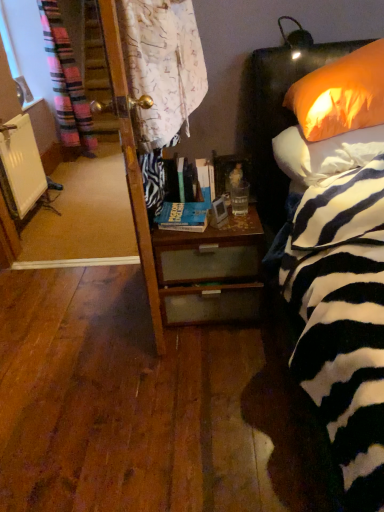
Locate an element on the screen. hardcover book at center, the second book positioned from the back is located at coordinates (183, 217).

Measure the distance between translucent glass at bedside and camera.

A distance of 5.94 feet exists between translucent glass at bedside and camera.

What do you see at coordinates (211, 272) in the screenshot?
I see `woodendesk at center` at bounding box center [211, 272].

Consider the image. In order to face orange fabric pillow at upper right, the first pillow ordered from the bottom, should I rotate leftwards or rightwards?

To face it directly, rotate right by 20.249 degrees.

You are a GUI agent. You are given a task and a screenshot of the screen. Output one action in this format:
    pyautogui.click(x=<x>, y=<y>)
    Task: Click on the hardcover book at center, the first book when ordered from bottom to top
    This screenshot has width=384, height=512.
    Given the screenshot: What is the action you would take?
    pyautogui.click(x=183, y=217)

From the image's perspective, is woodendesk at center above or below orange fabric pillow at upper right, arranged as the 2th pillow when ordered from the bottom?

Based on their image positions, woodendesk at center is located beneath orange fabric pillow at upper right, arranged as the 2th pillow when ordered from the bottom.

In the scene shown: What's the angular difference between woodendesk at center and orange fabric pillow at upper right, which is the 1th pillow from top to bottom,'s facing directions?

0.468 degrees separate the facing orientations of woodendesk at center and orange fabric pillow at upper right, which is the 1th pillow from top to bottom.

Is woodendesk at center facing away from orange fabric pillow at upper right, which is the 1th pillow from top to bottom?

No, woodendesk at center's orientation is not away from orange fabric pillow at upper right, which is the 1th pillow from top to bottom.

Is point (220, 230) positioned before point (335, 131)?

No, (220, 230) is further to viewer.

Considering the relative sizes of hardcover book at center, the 1th book from the front, and woodendesk at center in the image provided, is hardcover book at center, the 1th book from the front, shorter than woodendesk at center?

Yes, hardcover book at center, the 1th book from the front, is shorter than woodendesk at center.

Are hardcover book at center, the 1th book from the front, and woodendesk at center far apart?

hardcover book at center, the 1th book from the front, is near woodendesk at center, not far away.

Is hardcover book at center, the first book when ordered from bottom to top, oriented away from woodendesk at center?

No, hardcover book at center, the first book when ordered from bottom to top, is not facing the opposite direction of woodendesk at center.

Which object is positioned more to the left, hardcover book at center, which is counted as the 2th book, starting from the top, or woodendesk at center?

hardcover book at center, which is counted as the 2th book, starting from the top.

Is orange fabric pillow at upper right, marked as the second pillow in a top-to-bottom arrangement, looking in the opposite direction of white matte radiator at left?

orange fabric pillow at upper right, marked as the second pillow in a top-to-bottom arrangement, is not turned away from white matte radiator at left.

Can you confirm if orange fabric pillow at upper right, marked as the second pillow in a top-to-bottom arrangement, is shorter than white matte radiator at left?

Correct, orange fabric pillow at upper right, marked as the second pillow in a top-to-bottom arrangement, is not as tall as white matte radiator at left.

Consider the image. In terms of width, does orange fabric pillow at upper right, the first pillow ordered from the bottom, look wider or thinner when compared to white matte radiator at left?

Considering their sizes, orange fabric pillow at upper right, the first pillow ordered from the bottom, looks broader than white matte radiator at left.

Is orange fabric pillow at upper right, marked as the second pillow in a top-to-bottom arrangement, completely or partially outside of white matte radiator at left?

orange fabric pillow at upper right, marked as the second pillow in a top-to-bottom arrangement, lies outside white matte radiator at left's area.

From the image's perspective, between translucent glass at bedside and woodendesk at center, which one is located above?

translucent glass at bedside appears higher in the image.

Is translucent glass at bedside next to woodendesk at center?

No, translucent glass at bedside is not beside woodendesk at center.

Is translucent glass at bedside positioned with its back to woodendesk at center?

Correct, translucent glass at bedside is looking away from woodendesk at center.

Is hardcover book at center, which is the second book in bottom-to-top order, outside of white matte radiator at left?

hardcover book at center, which is the second book in bottom-to-top order, is positioned outside white matte radiator at left.

Which is farther from the camera, (x=210, y=186) or (x=22, y=172)?

The point (x=22, y=172) is farther from the camera.

From a real-world perspective, is hardcover book at center, which is the second book in bottom-to-top order, physically located above or below white matte radiator at left?

Clearly, from a real-world perspective, hardcover book at center, which is the second book in bottom-to-top order, is above white matte radiator at left.

From a real-world perspective, is translucent glass at bedside physically above orange fabric pillow at upper right, marked as the second pillow in a top-to-bottom arrangement?

Actually, translucent glass at bedside is physically below orange fabric pillow at upper right, marked as the second pillow in a top-to-bottom arrangement, in the real world.

In the image, is translucent glass at bedside positioned in front of or behind orange fabric pillow at upper right, marked as the second pillow in a top-to-bottom arrangement?

In the image, translucent glass at bedside appears behind orange fabric pillow at upper right, marked as the second pillow in a top-to-bottom arrangement.

Is translucent glass at bedside directly adjacent to orange fabric pillow at upper right, marked as the second pillow in a top-to-bottom arrangement?

They are not placed beside each other.

From the image's perspective, between orange fabric pillow at upper right, which is the 1th pillow from top to bottom, and hardcover book at center, which is counted as the 2th book, starting from the top, which one is located above?

orange fabric pillow at upper right, which is the 1th pillow from top to bottom, appears higher in the image.

Who is shorter, orange fabric pillow at upper right, arranged as the 2th pillow when ordered from the bottom, or hardcover book at center, the first book when ordered from bottom to top?

With less height is hardcover book at center, the first book when ordered from bottom to top.

Is orange fabric pillow at upper right, which is the 1th pillow from top to bottom, touching hardcover book at center, the second book positioned from the back?

No, orange fabric pillow at upper right, which is the 1th pillow from top to bottom, is not next to hardcover book at center, the second book positioned from the back.

Considering the sizes of objects orange fabric pillow at upper right, arranged as the 2th pillow when ordered from the bottom, and hardcover book at center, which is counted as the 2th book, starting from the top, in the image provided, who is wider, orange fabric pillow at upper right, arranged as the 2th pillow when ordered from the bottom, or hardcover book at center, which is counted as the 2th book, starting from the top,?

With larger width is orange fabric pillow at upper right, arranged as the 2th pillow when ordered from the bottom.

Image resolution: width=384 pixels, height=512 pixels. I want to click on pillow that is the 2nd object located in front of the woodendesk at center, so click(x=340, y=94).

Where is `desk below the hardcover book at center, which is counted as the 2th book, starting from the top (from the image's perspective)`? Image resolution: width=384 pixels, height=512 pixels. desk below the hardcover book at center, which is counted as the 2th book, starting from the top (from the image's perspective) is located at coordinates (211, 272).

Looking at the image, which one is located closer to orange fabric pillow at upper right, marked as the second pillow in a top-to-bottom arrangement, woodendesk at center or orange fabric pillow at upper right, arranged as the 2th pillow when ordered from the bottom?

The object closer to orange fabric pillow at upper right, marked as the second pillow in a top-to-bottom arrangement, is orange fabric pillow at upper right, arranged as the 2th pillow when ordered from the bottom.

Which object lies further to the anchor point orange fabric pillow at upper right, arranged as the 2th pillow when ordered from the bottom, hardcover book at center, which ranks as the 2th book in front-to-back order, or orange fabric pillow at upper right, marked as the second pillow in a top-to-bottom arrangement?

hardcover book at center, which ranks as the 2th book in front-to-back order, is positioned further to the anchor orange fabric pillow at upper right, arranged as the 2th pillow when ordered from the bottom.

From the image, which object appears to be farther from hardcover book at center, which ranks as the 2th book in front-to-back order, white matte radiator at left or orange fabric pillow at upper right, the first pillow ordered from the bottom?

The object further to hardcover book at center, which ranks as the 2th book in front-to-back order, is white matte radiator at left.

Considering their positions, is orange fabric pillow at upper right, which is the 1th pillow from top to bottom, positioned further to woodendesk at center than white matte radiator at left?

Among the two, white matte radiator at left is located further to woodendesk at center.

Based on their spatial positions, is orange fabric pillow at upper right, marked as the second pillow in a top-to-bottom arrangement, or translucent glass at bedside closer to hardcover book at center, the 1th book from the back?

Among the two, translucent glass at bedside is located nearer to hardcover book at center, the 1th book from the back.

Looking at the image, which one is located further to hardcover book at center, which ranks as the 2th book in front-to-back order, orange fabric pillow at upper right, which is the 1th pillow from top to bottom, or orange fabric pillow at upper right, marked as the second pillow in a top-to-bottom arrangement?

Based on the image, orange fabric pillow at upper right, which is the 1th pillow from top to bottom, appears to be further to hardcover book at center, which ranks as the 2th book in front-to-back order.

Based on the photo, based on their spatial positions, is hardcover book at center, which is the second book in bottom-to-top order, or hardcover book at center, the second book positioned from the back, closer to orange fabric pillow at upper right, arranged as the 2th pillow when ordered from the bottom?

The object closer to orange fabric pillow at upper right, arranged as the 2th pillow when ordered from the bottom, is hardcover book at center, which is the second book in bottom-to-top order.

Which object lies further to the anchor point orange fabric pillow at upper right, the first pillow ordered from the bottom, translucent glass at bedside or hardcover book at center, which is counted as the 2th book, starting from the top?

hardcover book at center, which is counted as the 2th book, starting from the top, is further to orange fabric pillow at upper right, the first pillow ordered from the bottom.

You are a GUI agent. You are given a task and a screenshot of the screen. Output one action in this format:
    pyautogui.click(x=<x>, y=<y>)
    Task: Click on the coffee cup between orange fabric pillow at upper right, which is the 1th pillow from top to bottom, and woodendesk at center, in the vertical direction
    The height and width of the screenshot is (512, 384).
    Given the screenshot: What is the action you would take?
    (240, 198)

Locate an element on the screen. pillow between orange fabric pillow at upper right, arranged as the 2th pillow when ordered from the bottom, and woodendesk at center vertically is located at coordinates (325, 154).

Locate an element on the screen. The width and height of the screenshot is (384, 512). book between hardcover book at center, the second book positioned from the back, and orange fabric pillow at upper right, the first pillow ordered from the bottom is located at coordinates (206, 180).

Locate an element on the screen. The width and height of the screenshot is (384, 512). desk situated between white matte radiator at left and orange fabric pillow at upper right, arranged as the 2th pillow when ordered from the bottom, from left to right is located at coordinates (211, 272).